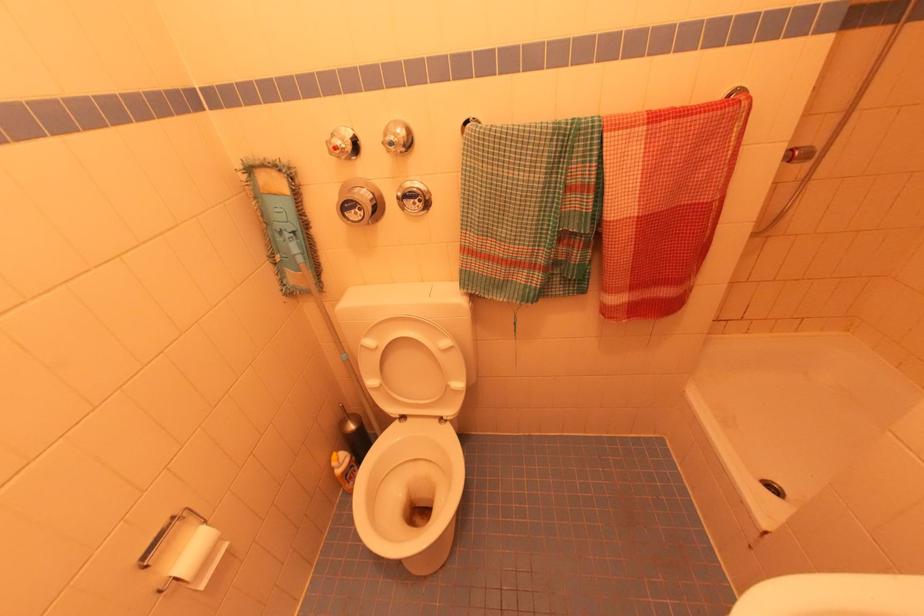
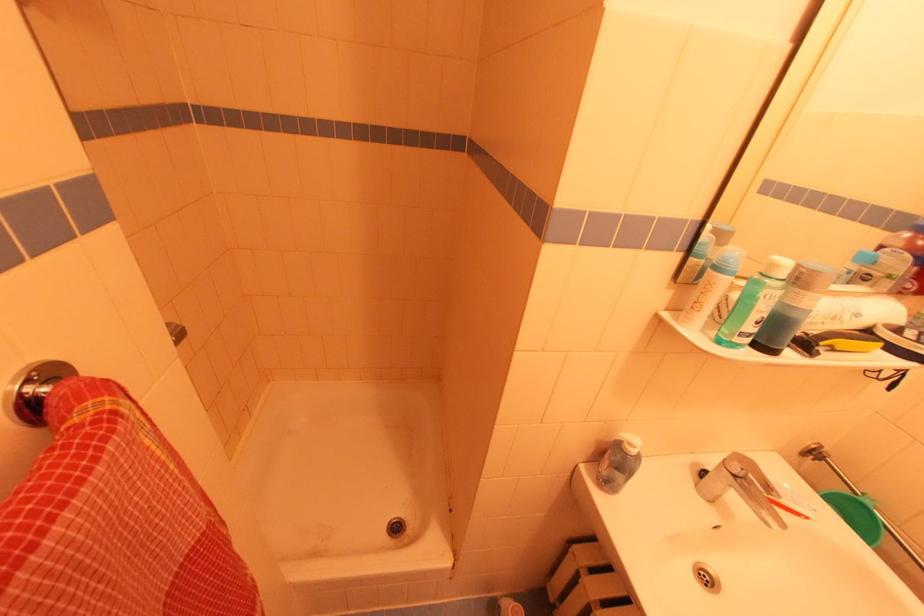
First-person continuous shooting, in which direction is the camera rotating?

The rotation direction of the camera is right-down.